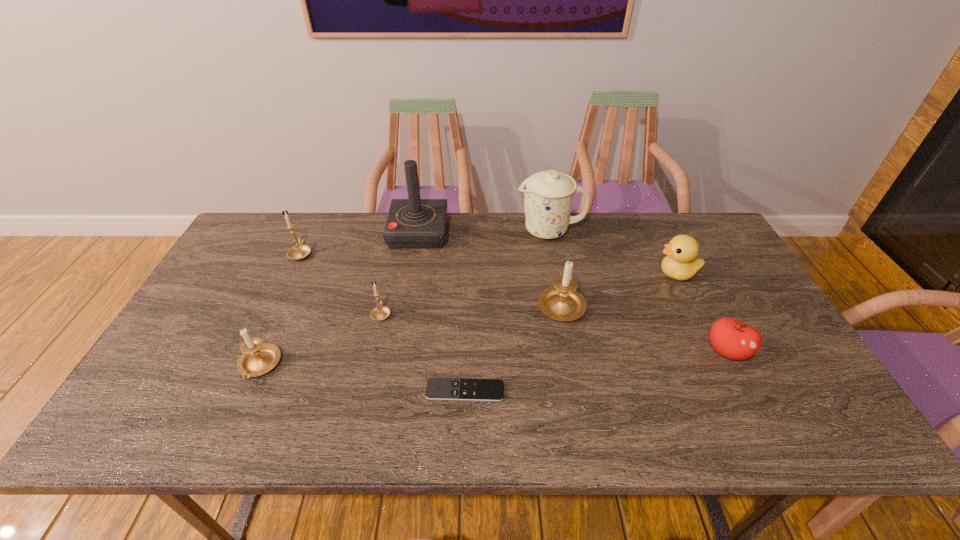
I want to click on the nearest candle holder, so click(x=258, y=358).

This screenshot has height=540, width=960. Identify the location of red apple. (731, 338).

You are a GUI agent. You are given a task and a screenshot of the screen. Output one action in this format:
    pyautogui.click(x=<x>, y=<y>)
    Task: Click on the shortest object
    The height and width of the screenshot is (540, 960).
    Given the screenshot: What is the action you would take?
    pyautogui.click(x=437, y=388)

Locate an element on the screen. Image resolution: width=960 pixels, height=540 pixels. remote control is located at coordinates (437, 388).

I want to click on vacant space located on the rectangular base of the red joystick, so click(x=564, y=232).

The width and height of the screenshot is (960, 540). Find the location of `blank area located on the spout of the second tallest object`. blank area located on the spout of the second tallest object is located at coordinates (396, 231).

Locate an element on the screen. This screenshot has height=540, width=960. vacant area situated 0.200m on the spout of the second tallest object is located at coordinates (456, 231).

Locate an element on the screen. This screenshot has height=540, width=960. vacant area situated on the spout of the second tallest object is located at coordinates (405, 231).

I want to click on blank space located 0.080m on the handle side of the farther gold candle holder, so click(x=312, y=230).

This screenshot has height=540, width=960. Find the location of `vacant space located 0.120m on the handle side of the farther gold candle holder`. vacant space located 0.120m on the handle side of the farther gold candle holder is located at coordinates (316, 222).